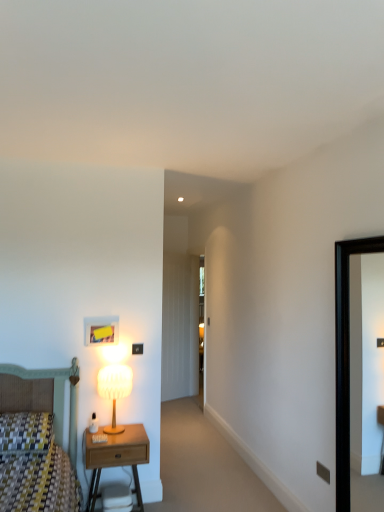
Question: From the image's perspective, relative to wooden nightstand at lower left, is black glossy picture frame at right above or below?

Choices:
 (A) above
 (B) below

Answer: (A)

Question: From their relative heights in the image, would you say black glossy picture frame at right is taller or shorter than wooden nightstand at lower left?

Choices:
 (A) tall
 (B) short

Answer: (A)

Question: Which is farther from the matte white lamp at left?

Choices:
 (A) transparent glass door at center
 (B) matte black electric outlet at lower right
 (C) black glossy picture frame at right
 (D) wooden nightstand at lower left

Answer: (A)

Question: Which is nearer to the transparent glass door at center?

Choices:
 (A) matte black electric outlet at lower right
 (B) wooden nightstand at lower left
 (C) matte white lamp at left
 (D) black glossy picture frame at right

Answer: (C)